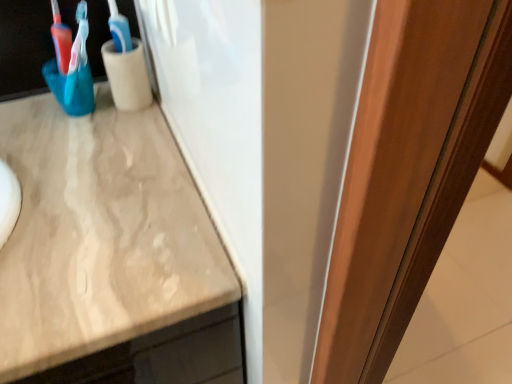
Question: Is blue plastic toothbrush at upper left taller than smooth wooden door at right?

Choices:
 (A) no
 (B) yes

Answer: (A)

Question: From a real-world perspective, is blue plastic toothbrush at upper left on top of smooth wooden door at right?

Choices:
 (A) yes
 (B) no

Answer: (A)

Question: From the image's perspective, is blue plastic toothbrush at upper left on smooth wooden door at right?

Choices:
 (A) yes
 (B) no

Answer: (A)

Question: Is blue plastic toothbrush at upper left turned away from smooth wooden door at right?

Choices:
 (A) yes
 (B) no

Answer: (B)

Question: Can you confirm if blue plastic toothbrush at upper left is positioned to the right of smooth wooden door at right?

Choices:
 (A) no
 (B) yes

Answer: (A)

Question: Is blue plastic toothbrush at upper left far from smooth wooden door at right?

Choices:
 (A) no
 (B) yes

Answer: (A)

Question: Is the position of smooth wooden door at right less distant than that of blue plastic toothbrush at upper left?

Choices:
 (A) yes
 (B) no

Answer: (A)

Question: Considering the relative sizes of smooth wooden door at right and blue plastic toothbrush at upper left in the image provided, is smooth wooden door at right shorter than blue plastic toothbrush at upper left?

Choices:
 (A) yes
 (B) no

Answer: (B)

Question: Is the depth of smooth wooden door at right greater than that of blue plastic toothbrush at upper left?

Choices:
 (A) yes
 (B) no

Answer: (B)

Question: Does smooth wooden door at right have a greater height compared to blue plastic toothbrush at upper left?

Choices:
 (A) yes
 (B) no

Answer: (A)

Question: Does smooth wooden door at right turn towards blue plastic toothbrush at upper left?

Choices:
 (A) no
 (B) yes

Answer: (A)

Question: From the image's perspective, is smooth wooden door at right on blue plastic toothbrush at upper left?

Choices:
 (A) no
 (B) yes

Answer: (A)

Question: Relative to blue plastic toothbrush at upper left, is smooth wooden door at right in front or behind?

Choices:
 (A) front
 (B) behind

Answer: (A)